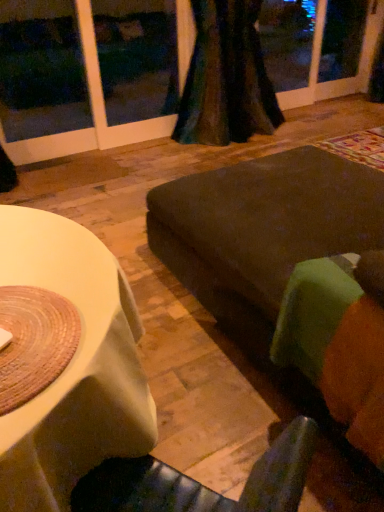
Question: From their relative heights in the image, would you say dark brown fabric couch at center, which appears as the 1th couch when viewed from the back, is taller or shorter than green fabric couch at lower right, the first couch in the front-to-back sequence?

Choices:
 (A) short
 (B) tall

Answer: (B)

Question: From the image's perspective, is dark brown fabric couch at center, which appears as the 1th couch when viewed from the back, positioned above or below green fabric couch at lower right, the second couch in the back-to-front sequence?

Choices:
 (A) below
 (B) above

Answer: (B)

Question: Which is nearer to the dark brown fabric couch at center, which appears as the 1th couch when viewed from the back?

Choices:
 (A) green fabric couch at lower right, the first couch in the front-to-back sequence
 (B) velvet dark green curtain at upper center

Answer: (A)

Question: Which is farther from the dark brown fabric couch at center, which appears as the 1th couch when viewed from the back?

Choices:
 (A) velvet dark green curtain at upper center
 (B) green fabric couch at lower right, the second couch in the back-to-front sequence

Answer: (A)